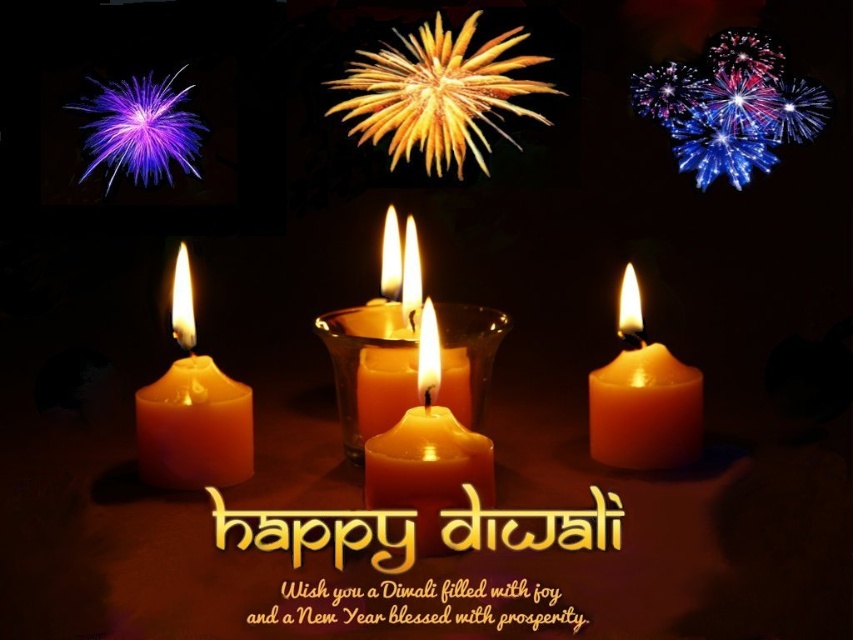
Question: Can you confirm if matte orange candle at lower left is positioned to the right of matte orange candle at center?

Choices:
 (A) no
 (B) yes

Answer: (A)

Question: Considering the real-world distances, which object is closest to the matte wax candle at center?

Choices:
 (A) sparkling glass fireworks at upper right
 (B) matte orange candle at center
 (C) matte orange candle at lower left

Answer: (B)

Question: Based on their relative distances, which object is nearer to the matte orange candle at center?

Choices:
 (A) sparkling glass fireworks at upper right
 (B) matte orange candle at lower left

Answer: (B)

Question: Which object is positioned closest to the matte wax candle at center?

Choices:
 (A) sparkling glass fireworks at upper right
 (B) matte orange candle at lower right

Answer: (B)

Question: Where is matte orange candle at lower left located in relation to matte orange candle at lower right in the image?

Choices:
 (A) right
 (B) left

Answer: (B)

Question: Is matte orange candle at lower left to the left of matte orange candle at lower right from the viewer's perspective?

Choices:
 (A) yes
 (B) no

Answer: (A)